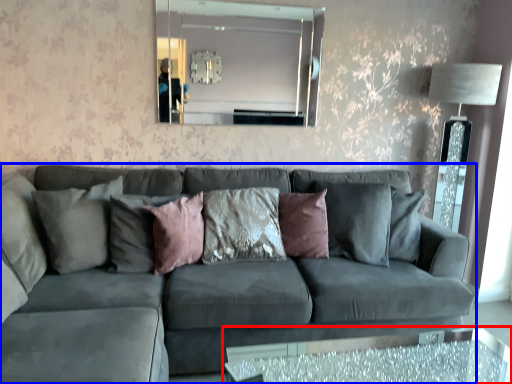
Question: Which of the following is the closest to the observer, table (highlighted by a red box) or studio couch (highlighted by a blue box)?

Choices:
 (A) table
 (B) studio couch

Answer: (B)